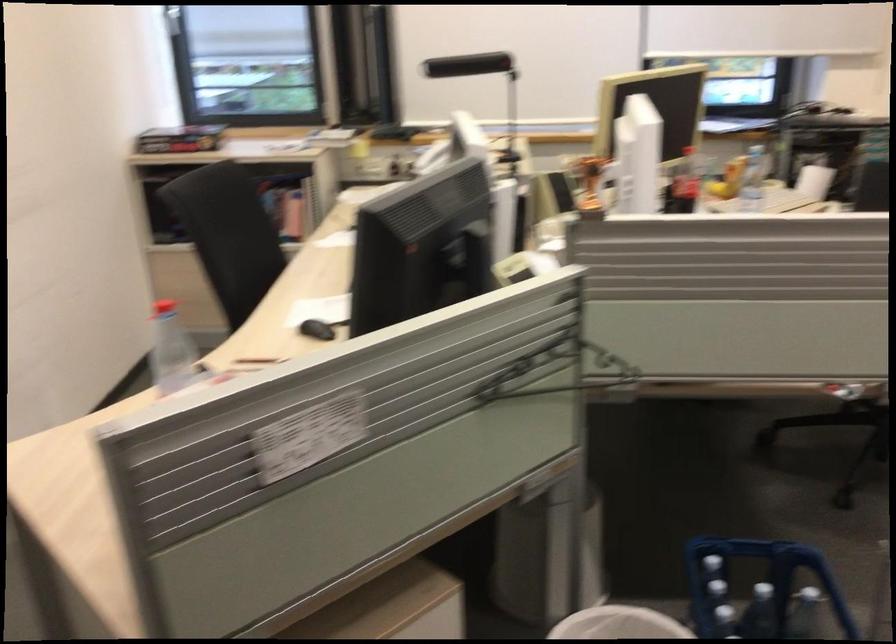
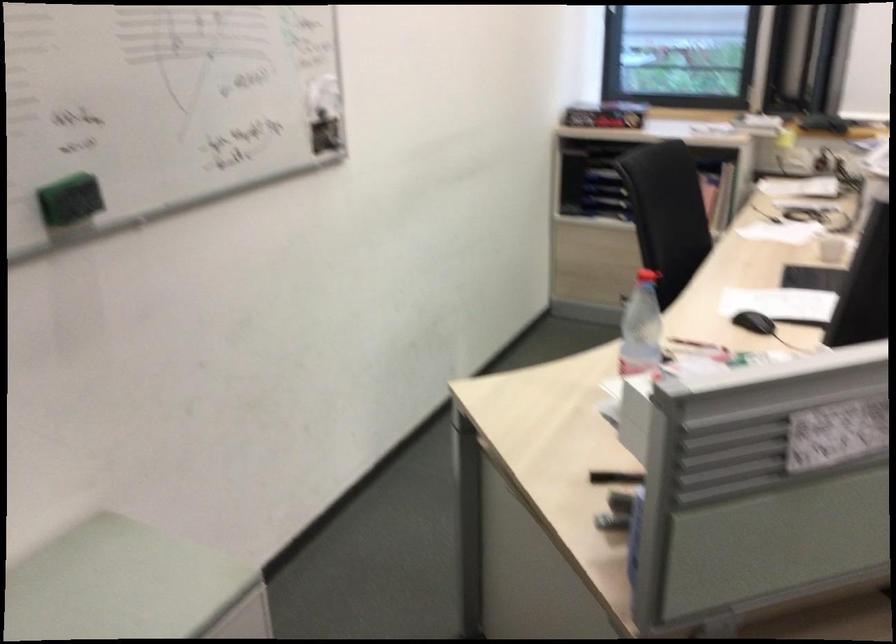
Where in the second image is the point corresponding to the point at 176,359 from the first image?

(641, 327)